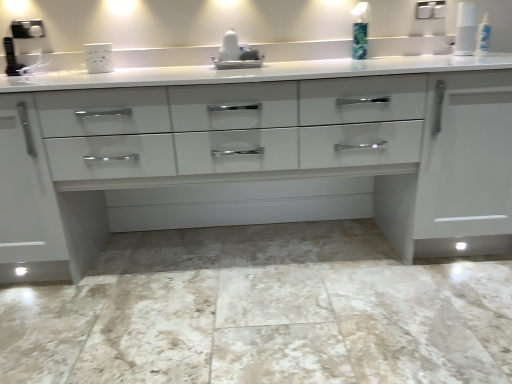
Question: Is point (253, 59) positioned closer to the camera than point (223, 382)?

Choices:
 (A) closer
 (B) farther

Answer: (B)

Question: Choose the correct answer: Is white glossy sink at center inside marble tile floor at center or outside it?

Choices:
 (A) inside
 (B) outside

Answer: (B)

Question: Which object is the farthest from the white glossy chest of drawers at center?

Choices:
 (A) marble tile floor at center
 (B) white glossy sink at center
 (C) white matte mug at upper center
 (D) green plastic soap dispenser at upper right

Answer: (C)

Question: Estimate the real-world distances between objects in this image. Which object is farther from the marble tile floor at center?

Choices:
 (A) white matte mug at upper center
 (B) green plastic soap dispenser at upper right
 (C) white glossy sink at center
 (D) white glossy chest of drawers at center

Answer: (A)